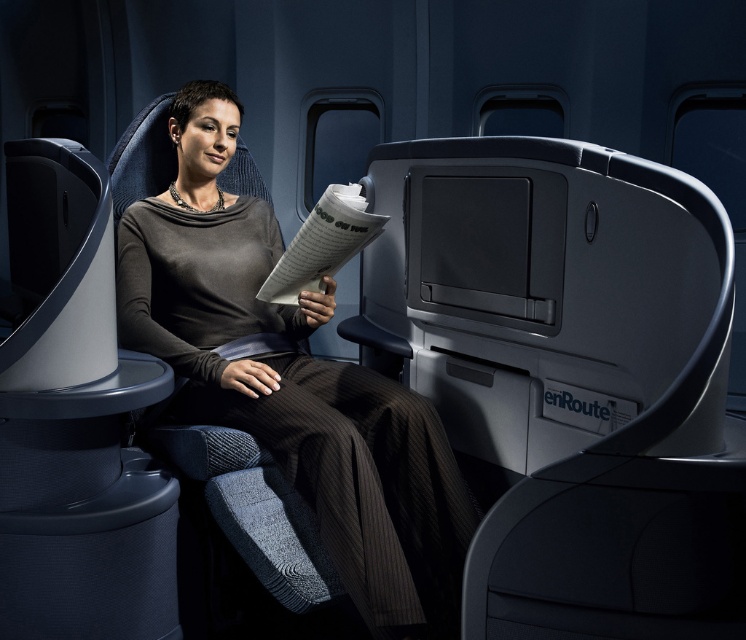
Is point (451, 566) positioned behind point (286, 273)?

No.

Is matte gray sweater at center wider than white paper at center?

Indeed, matte gray sweater at center has a greater width compared to white paper at center.

Who is more distant from viewer, (145,337) or (307,246)?

Positioned behind is point (145,337).

The width and height of the screenshot is (746, 640). Find the location of `matte gray sweater at center`. matte gray sweater at center is located at coordinates point(292,381).